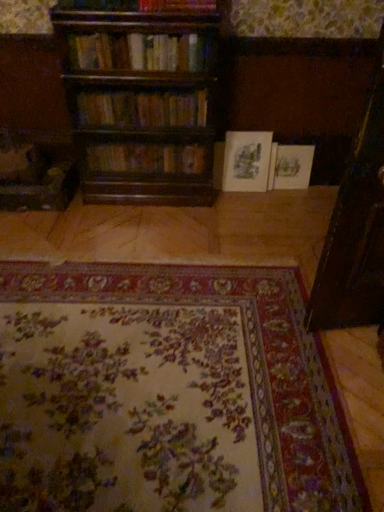
Question: From the image's perspective, is wooden bookshelf at upper center, the first book from the front, under wooden bookshelf at center, which appears as the third book when viewed from the front?

Choices:
 (A) no
 (B) yes

Answer: (A)

Question: From a real-world perspective, is wooden bookshelf at upper center, the fifth book viewed from the back, beneath wooden bookshelf at center, which appears as the third book when viewed from the front?

Choices:
 (A) yes
 (B) no

Answer: (B)

Question: Considering the relative sizes of wooden bookshelf at upper center, the first book from the front, and wooden bookshelf at center, which appears as the third book when viewed from the front, in the image provided, is wooden bookshelf at upper center, the first book from the front, shorter than wooden bookshelf at center, which appears as the third book when viewed from the front,?

Choices:
 (A) yes
 (B) no

Answer: (B)

Question: From the image's perspective, is wooden bookshelf at upper center, the fifth book viewed from the back, above wooden bookshelf at center, the 3th book in the back-to-front sequence?

Choices:
 (A) yes
 (B) no

Answer: (A)

Question: Is wooden bookshelf at upper center, the first book from the front, taller than wooden bookshelf at center, which appears as the third book when viewed from the front?

Choices:
 (A) yes
 (B) no

Answer: (A)

Question: Considering the positions of wooden bookshelf at center, marked as the second book in a front-to-back arrangement, and white paper book at center, the 5th book in the front-to-back sequence, in the image, is wooden bookshelf at center, marked as the second book in a front-to-back arrangement, taller or shorter than white paper book at center, the 5th book in the front-to-back sequence,?

Choices:
 (A) short
 (B) tall

Answer: (A)

Question: From the image's perspective, relative to white paper book at center, the 1th book positioned from the back, is wooden bookshelf at center, placed as the 4th book when sorted from back to front, above or below?

Choices:
 (A) below
 (B) above

Answer: (B)

Question: Does point [183, 95] appear closer or farther from the camera than point [283, 152]?

Choices:
 (A) farther
 (B) closer

Answer: (B)

Question: From a real-world perspective, is wooden bookshelf at center, marked as the second book in a front-to-back arrangement, above or below white paper book at center, the 1th book positioned from the back?

Choices:
 (A) above
 (B) below

Answer: (A)

Question: From the image's perspective, is wooden bookshelf at center, which appears as the third book when viewed from the front, above or below wooden bookshelf at upper center, the fifth book viewed from the back?

Choices:
 (A) below
 (B) above

Answer: (A)

Question: From a real-world perspective, is wooden bookshelf at center, the 3th book in the back-to-front sequence, physically located above or below wooden bookshelf at upper center, the fifth book viewed from the back?

Choices:
 (A) above
 (B) below

Answer: (B)

Question: Visually, is wooden bookshelf at center, which appears as the third book when viewed from the front, positioned to the left or to the right of wooden bookshelf at upper center, the first book from the front?

Choices:
 (A) right
 (B) left

Answer: (A)

Question: Looking at their shapes, would you say wooden bookshelf at center, which appears as the third book when viewed from the front, is wider or thinner than wooden bookshelf at upper center, the fifth book viewed from the back?

Choices:
 (A) thin
 (B) wide

Answer: (A)

Question: From the image's perspective, is matte paper book at center, arranged as the second book when viewed from the back, above or below floral carpet at center?

Choices:
 (A) below
 (B) above

Answer: (B)

Question: Is matte paper book at center, the fourth book viewed from the front, situated inside floral carpet at center or outside?

Choices:
 (A) outside
 (B) inside

Answer: (A)